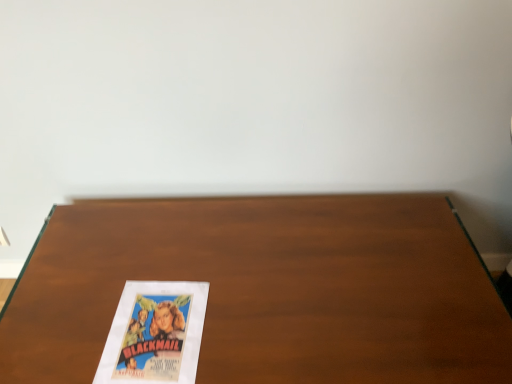
You are a GUI agent. You are given a task and a screenshot of the screen. Output one action in this format:
    pyautogui.click(x=<x>, y=<y>)
    Task: Click on the vacant space situated above vintage paper at bottom left (from a real-world perspective)
    Image resolution: width=512 pixels, height=384 pixels.
    Given the screenshot: What is the action you would take?
    pyautogui.click(x=153, y=328)